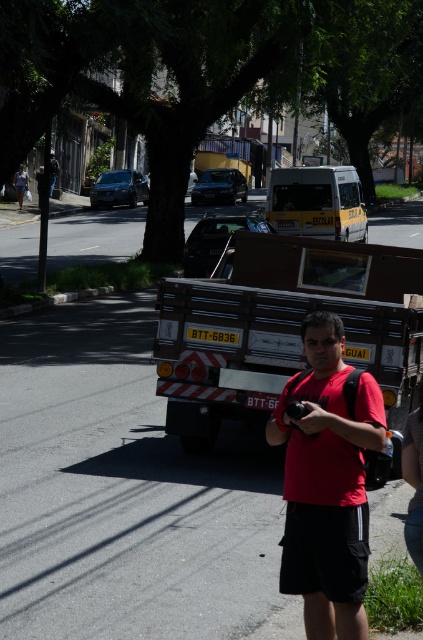
Can you confirm if matte red t-shirt at center is wider than black fabric shorts at lower right?

Yes.

Which is in front, point (343, 550) or point (422, 387)?

Positioned in front is point (343, 550).

Locate an element on the screen. This screenshot has height=640, width=423. matte red t-shirt at center is located at coordinates (326, 481).

Is metallic silver fire truck at center below black fabric shorts at lower right?

No, metallic silver fire truck at center is not below black fabric shorts at lower right.

From the picture: Does metallic silver fire truck at center have a smaller size compared to black fabric shorts at lower right?

Incorrect, metallic silver fire truck at center is not smaller in size than black fabric shorts at lower right.

Is point (398, 307) positioned before point (417, 424)?

No, (398, 307) is further to viewer.

Locate an element on the screen. This screenshot has width=423, height=640. metallic silver fire truck at center is located at coordinates (282, 326).

Can you confirm if metallic silver fire truck at center is wider than matte red t-shirt at center?

Correct, the width of metallic silver fire truck at center exceeds that of matte red t-shirt at center.

Does point (420, 358) lie behind point (297, 476)?

Yes, point (420, 358) is behind point (297, 476).

At what (x,y) coordinates should I click in order to perform the action: click on metallic silver fire truck at center. Please return your answer as a coordinate pair (x, y). Looking at the image, I should click on (282, 326).